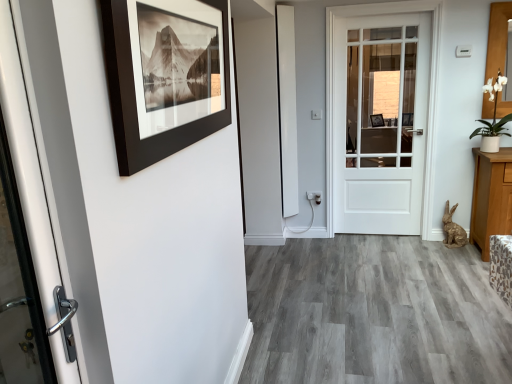
Question: From a real-world perspective, is black matte picture frame at upper left located higher than white matte door at center?

Choices:
 (A) yes
 (B) no

Answer: (A)

Question: Does black matte picture frame at upper left appear on the left side of white matte door at center?

Choices:
 (A) no
 (B) yes

Answer: (B)

Question: From a real-world perspective, is black matte picture frame at upper left below white matte door at center?

Choices:
 (A) yes
 (B) no

Answer: (B)

Question: Would you say white matte door at center is part of black matte picture frame at upper left's contents?

Choices:
 (A) no
 (B) yes

Answer: (A)

Question: Does black matte picture frame at upper left have a smaller size compared to white matte door at center?

Choices:
 (A) yes
 (B) no

Answer: (A)

Question: From the image's perspective, is black matte picture frame at upper left on white matte door at center?

Choices:
 (A) yes
 (B) no

Answer: (B)

Question: Could black matte picture frame at upper left be considered to be inside white ceramic pot at upper right?

Choices:
 (A) yes
 (B) no

Answer: (B)

Question: Can you confirm if white ceramic pot at upper right is positioned to the left of black matte picture frame at upper left?

Choices:
 (A) no
 (B) yes

Answer: (A)

Question: Is white ceramic pot at upper right further to the viewer compared to black matte picture frame at upper left?

Choices:
 (A) yes
 (B) no

Answer: (A)

Question: Considering the relative sizes of white ceramic pot at upper right and black matte picture frame at upper left in the image provided, is white ceramic pot at upper right smaller than black matte picture frame at upper left?

Choices:
 (A) yes
 (B) no

Answer: (B)

Question: Is white ceramic pot at upper right far away from black matte picture frame at upper left?

Choices:
 (A) yes
 (B) no

Answer: (A)

Question: From the image's perspective, would you say white ceramic pot at upper right is shown under black matte picture frame at upper left?

Choices:
 (A) no
 (B) yes

Answer: (A)

Question: Considering the relative sizes of white matte door at center and black matte picture frame at upper left in the image provided, is white matte door at center wider than black matte picture frame at upper left?

Choices:
 (A) yes
 (B) no

Answer: (A)